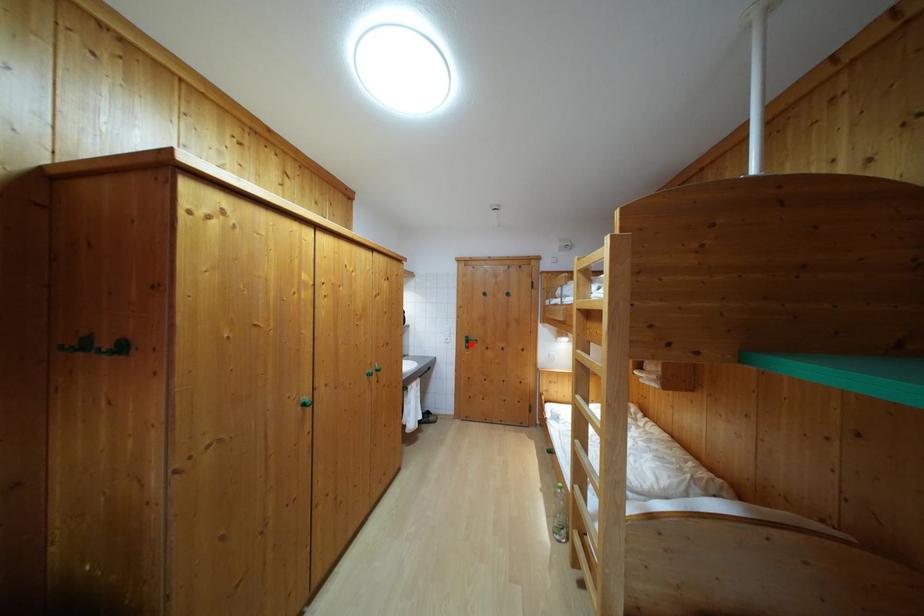
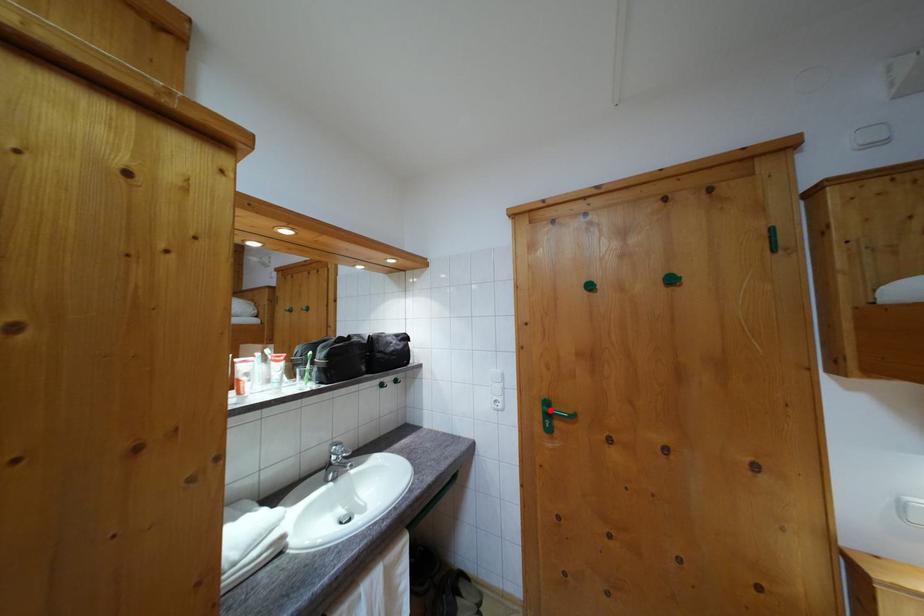
I am providing you with two images of the same scene from different viewpoints. A red point is marked on the first image and another point is marked on the second image. Is the red point in image1 aligned with the point shown in image2?

Yes